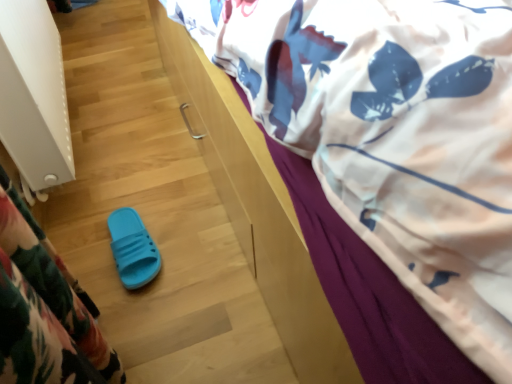
Question: Is white textured radiator at left positioned with its back to white printed fabric at upper right?

Choices:
 (A) yes
 (B) no

Answer: (B)

Question: Is white textured radiator at left positioned beyond the bounds of white printed fabric at upper right?

Choices:
 (A) no
 (B) yes

Answer: (B)

Question: Does white textured radiator at left have a smaller size compared to white printed fabric at upper right?

Choices:
 (A) no
 (B) yes

Answer: (B)

Question: Considering the relative sizes of white textured radiator at left and white printed fabric at upper right in the image provided, is white textured radiator at left thinner than white printed fabric at upper right?

Choices:
 (A) no
 (B) yes

Answer: (B)

Question: Considering the relative positions of white textured radiator at left and white printed fabric at upper right in the image provided, is white textured radiator at left in front of white printed fabric at upper right?

Choices:
 (A) yes
 (B) no

Answer: (B)

Question: Based on their positions, is white printed fabric at upper right located to the left or right of blue rubber slipper at lower left?

Choices:
 (A) left
 (B) right

Answer: (B)

Question: In the image, is white printed fabric at upper right positioned in front of or behind blue rubber slipper at lower left?

Choices:
 (A) behind
 (B) front

Answer: (B)

Question: Is white printed fabric at upper right inside or outside of blue rubber slipper at lower left?

Choices:
 (A) outside
 (B) inside

Answer: (A)

Question: Based on their sizes in the image, would you say white printed fabric at upper right is bigger or smaller than blue rubber slipper at lower left?

Choices:
 (A) big
 (B) small

Answer: (A)

Question: Is point (117, 264) closer or farther from the camera than point (27, 148)?

Choices:
 (A) farther
 (B) closer

Answer: (A)

Question: From a real-world perspective, relative to white textured radiator at left, is blue rubber slipper at lower left vertically above or below?

Choices:
 (A) below
 (B) above

Answer: (A)

Question: Considering the relative positions of blue rubber slipper at lower left and white textured radiator at left in the image provided, is blue rubber slipper at lower left to the left or to the right of white textured radiator at left?

Choices:
 (A) left
 (B) right

Answer: (B)

Question: Is blue rubber slipper at lower left spatially inside white textured radiator at left, or outside of it?

Choices:
 (A) inside
 (B) outside

Answer: (B)

Question: From a real-world perspective, relative to white printed fabric at upper right, is white textured radiator at left vertically above or below?

Choices:
 (A) above
 (B) below

Answer: (B)

Question: From the image's perspective, is white textured radiator at left above or below white printed fabric at upper right?

Choices:
 (A) below
 (B) above

Answer: (A)